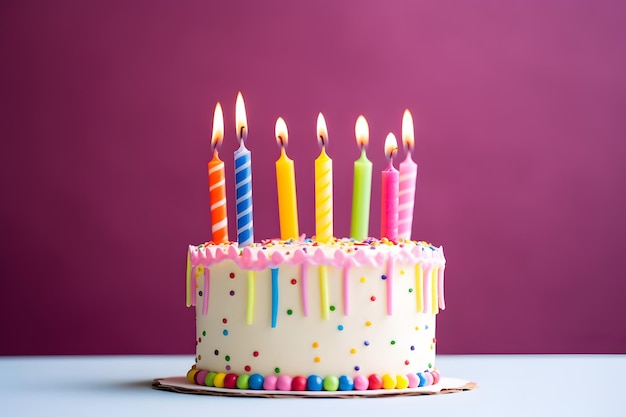
Where is `candles`? The image size is (626, 417). candles is located at coordinates (223, 216), (244, 218), (290, 212), (325, 214), (359, 213), (389, 213), (414, 210).